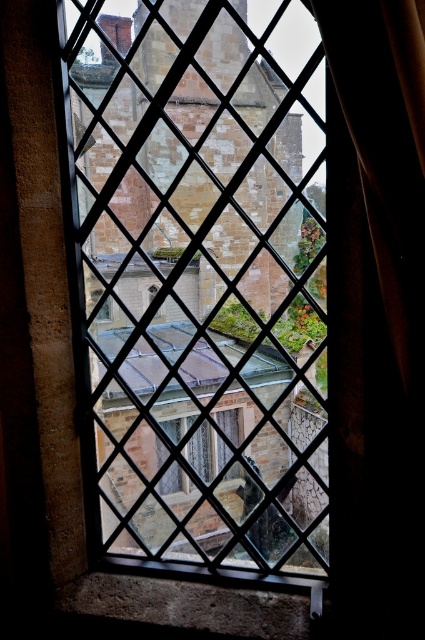
Question: Is black fabric curtain at right wider than clear glass window at center?

Choices:
 (A) yes
 (B) no

Answer: (B)

Question: In this image, where is brown stone tower at center located relative to clear glass window at center?

Choices:
 (A) below
 (B) above

Answer: (B)

Question: Estimate the real-world distances between objects in this image. Which object is closer to the brown stone tower at center?

Choices:
 (A) black fabric curtain at right
 (B) clear glass window at center

Answer: (B)

Question: Which of these objects is positioned closest to the clear glass window at center?

Choices:
 (A) brown stone tower at center
 (B) black fabric curtain at right

Answer: (A)

Question: Which point is farther from the camera taking this photo?

Choices:
 (A) (180, 440)
 (B) (413, 179)

Answer: (A)

Question: Is black fabric curtain at right to the right of clear glass window at center from the viewer's perspective?

Choices:
 (A) no
 (B) yes

Answer: (B)